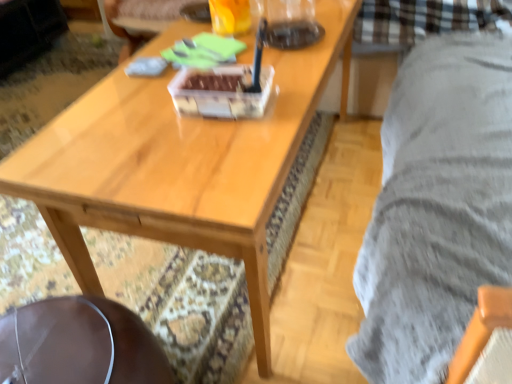
Question: From the image's perspective, is translucent glass beverage at upper center positioned above or below wooden coffee table at center?

Choices:
 (A) below
 (B) above

Answer: (B)

Question: In the image, is translucent glass beverage at upper center positioned in front of or behind wooden coffee table at center?

Choices:
 (A) behind
 (B) front

Answer: (A)

Question: Which is nearer to the translucent glass beverage at upper center?

Choices:
 (A) brown leather swivel chair at lower left
 (B) wooden coffee table at center

Answer: (B)

Question: Which object is the closest to the translucent glass beverage at upper center?

Choices:
 (A) wooden coffee table at center
 (B) brown leather swivel chair at lower left

Answer: (A)